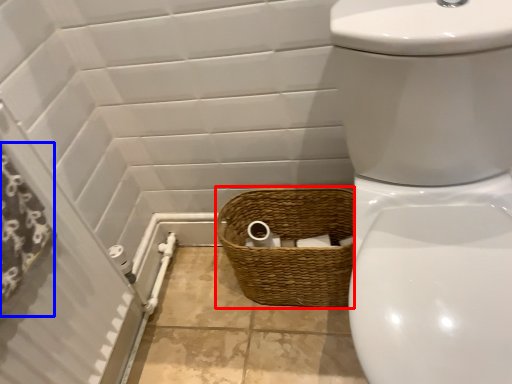
Question: Which point is closer to the camera, basket (highlighted by a red box) or shower curtain (highlighted by a blue box)?

Choices:
 (A) basket
 (B) shower curtain

Answer: (B)